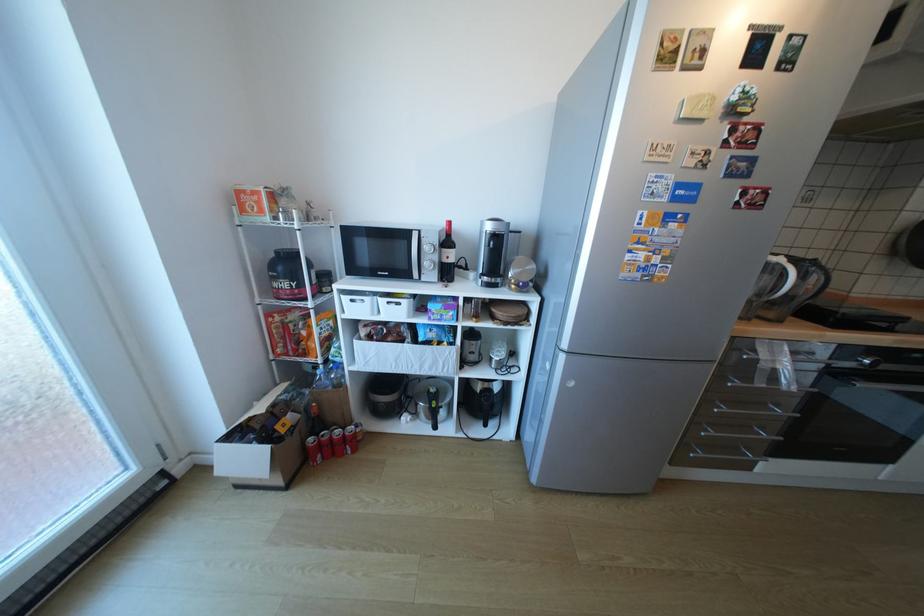
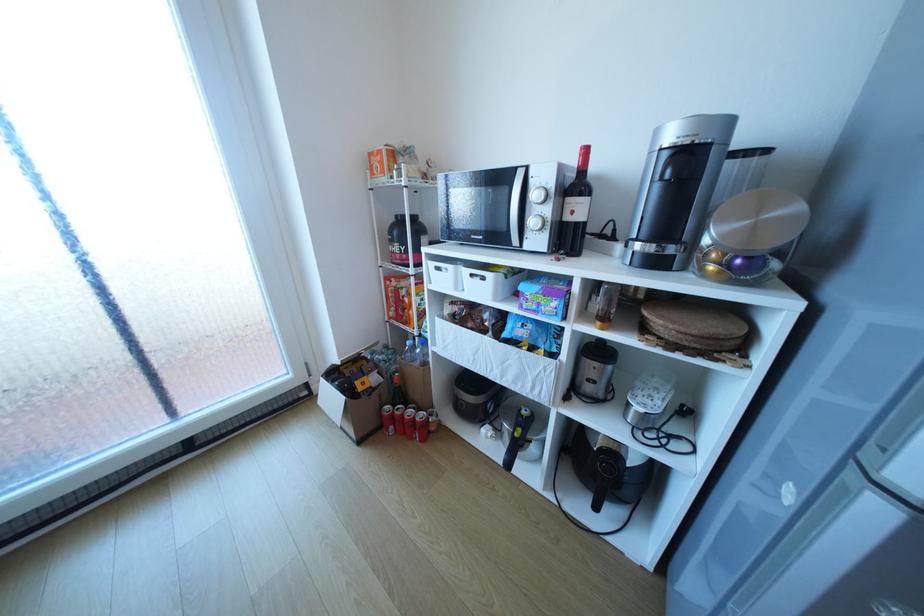
Question: Based on the continuous images, in which direction is the camera rotating? Reply with the corresponding letter.

Choices:
 (A) Left
 (B) Right
 (C) Up
 (D) Down

Answer: (A)